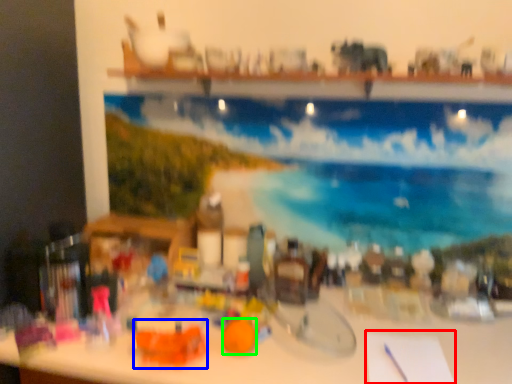
Question: Estimate the real-world distances between objects in this image. Which object is farther from notepad (highlighted by a red box), toy (highlighted by a blue box) or toy (highlighted by a green box)?

Choices:
 (A) toy
 (B) toy

Answer: (A)